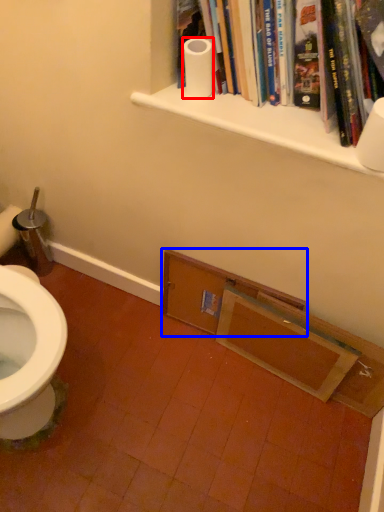
Question: Which object appears farthest to the camera in this image, toilet paper (highlighted by a red box) or shelf (highlighted by a blue box)?

Choices:
 (A) toilet paper
 (B) shelf

Answer: (B)